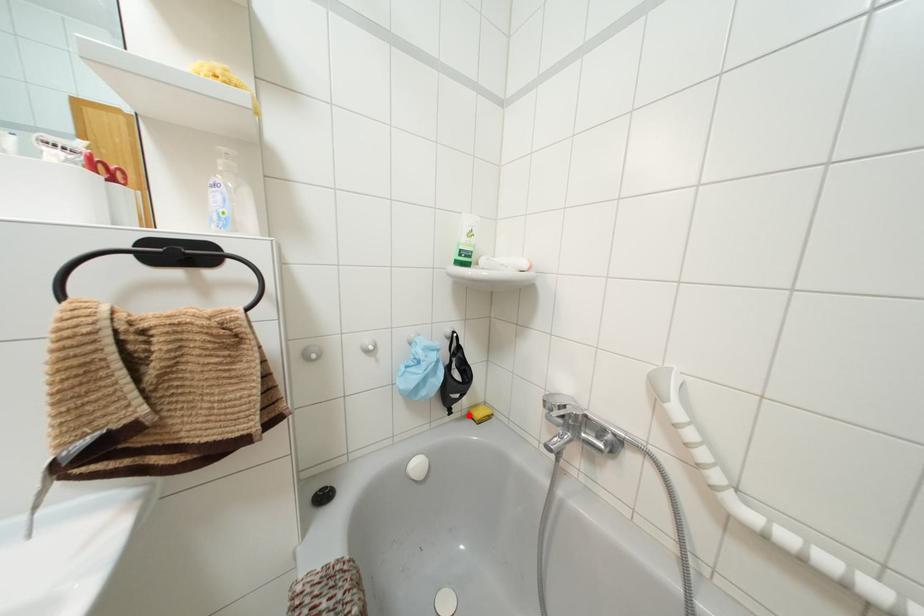
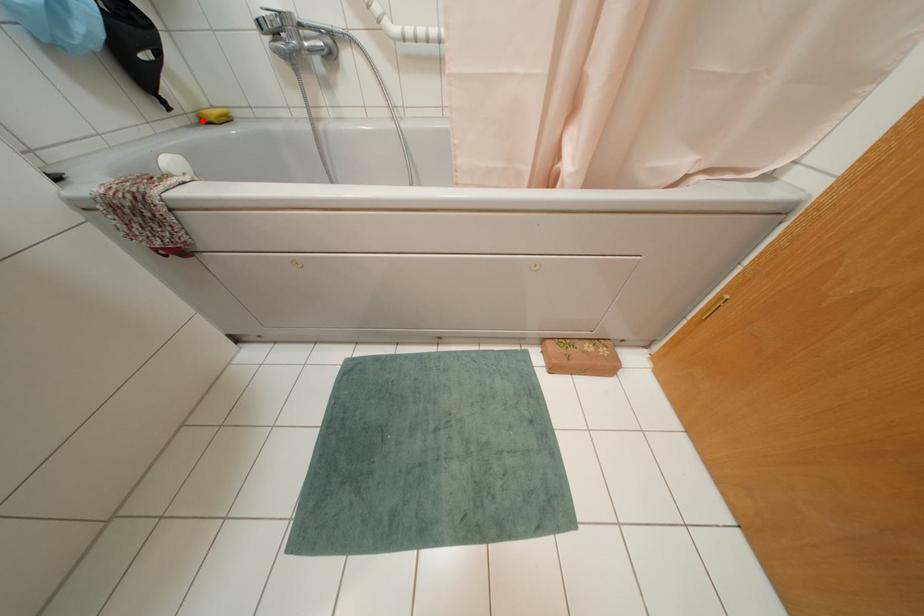
I am providing you with two images of the same scene from different viewpoints. A red point is marked on the first image and another point is marked on the second image. Is the red point in image1 aligned with the point shown in image2?

Yes